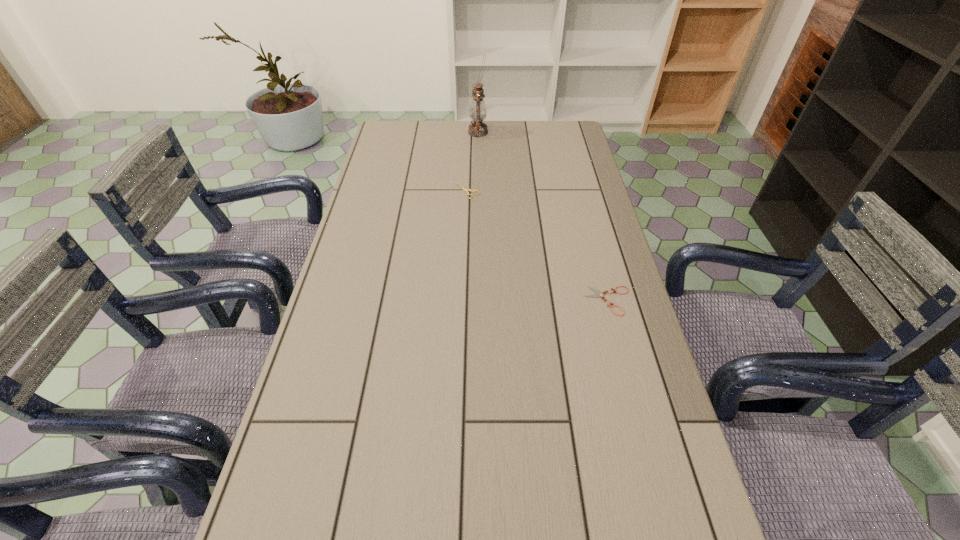
Image resolution: width=960 pixels, height=540 pixels. What are the coordinates of `free spot between the left shears and the oil lamp` in the screenshot? It's located at (472, 162).

Where is `blank region between the farther shears and the right shears`? blank region between the farther shears and the right shears is located at coordinates (538, 246).

Select which object is the closest to the second farthest object. Please provide its 2D coordinates. Your answer should be formatted as a tuple, i.e. [(x, y)], where the tuple contains the x and y coordinates of a point satisfying the conditions above.

[(477, 111)]

Select which object is the closest to the nearest object. Please provide its 2D coordinates. Your answer should be formatted as a tuple, i.e. [(x, y)], where the tuple contains the x and y coordinates of a point satisfying the conditions above.

[(466, 190)]

Select which shears is the second closest to the oil lamp. Please provide its 2D coordinates. Your answer should be formatted as a tuple, i.e. [(x, y)], where the tuple contains the x and y coordinates of a point satisfying the conditions above.

[(599, 294)]

Locate which shears is the closest to the oil lamp. Please provide its 2D coordinates. Your answer should be formatted as a tuple, i.e. [(x, y)], where the tuple contains the x and y coordinates of a point satisfying the conditions above.

[(466, 190)]

Locate an element on the screen. The image size is (960, 540). free spot that satisfies the following two spatial constraints: 1. on the front side of the nearest object; 2. on the right side of the farthest object is located at coordinates (477, 301).

This screenshot has width=960, height=540. Identify the location of free space that satisfies the following two spatial constraints: 1. on the front side of the rightmost object; 2. on the right side of the second nearest object. (464, 301).

Where is `vacant space that satisfies the following two spatial constraints: 1. on the front side of the second nearest object; 2. on the right side of the right shears`? The image size is (960, 540). vacant space that satisfies the following two spatial constraints: 1. on the front side of the second nearest object; 2. on the right side of the right shears is located at coordinates (464, 301).